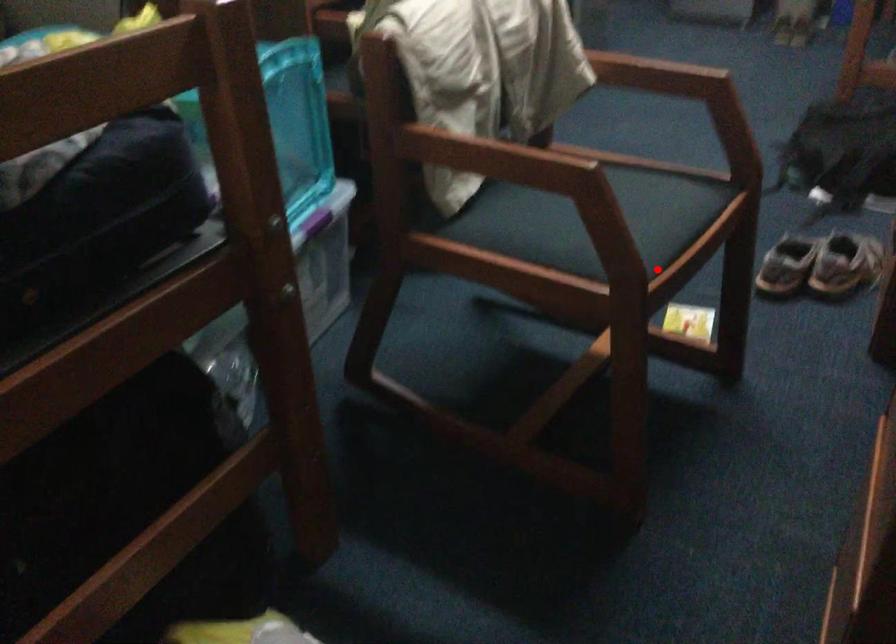
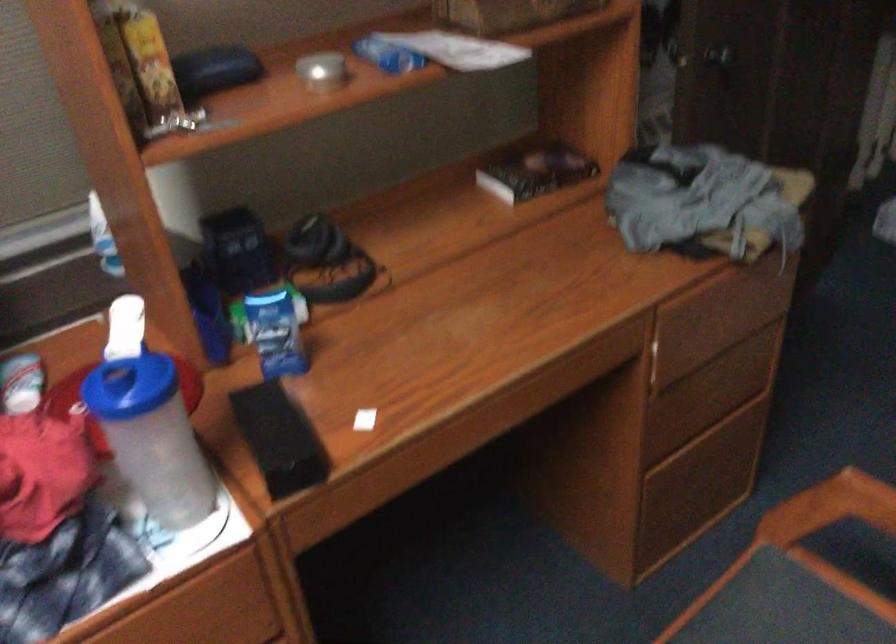
Question: A red point is marked in image1. In image2, is the corresponding 3D point closer to the camera or farther? Reply with the corresponding letter.

Choices:
 (A) The corresponding 3D point is closer.
 (B) The corresponding 3D point is farther.

Answer: (A)